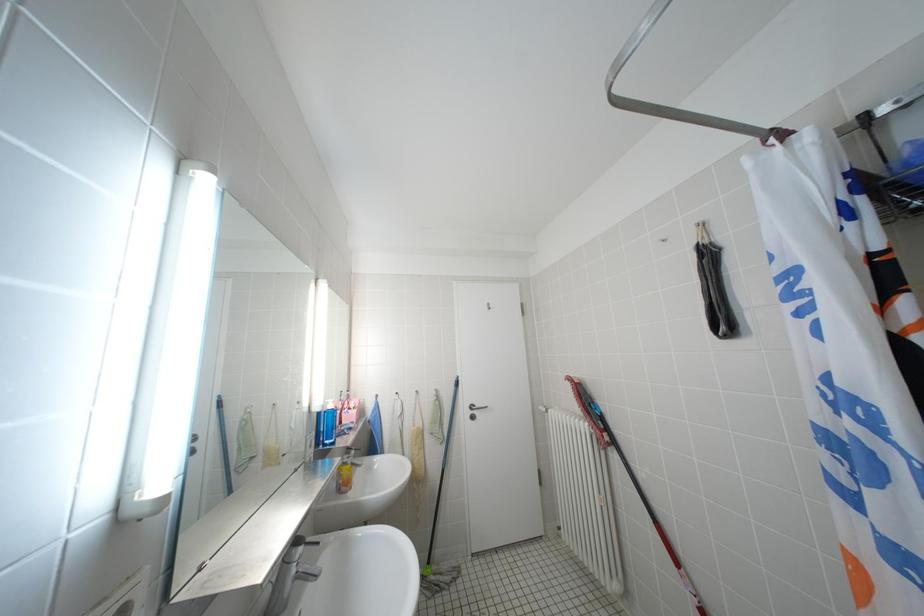
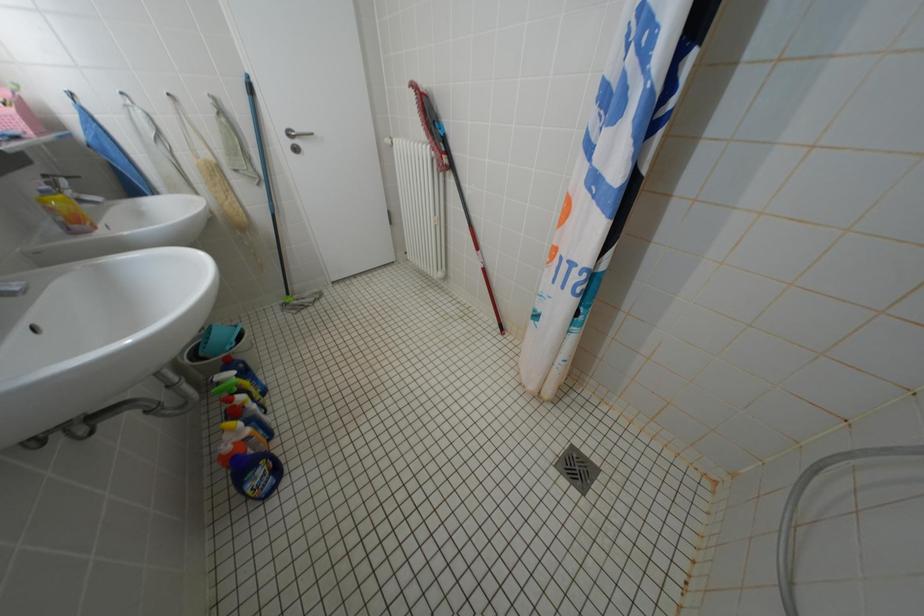
Based on the continuous images, in which direction is the camera rotating?

The camera rotated toward right-down.